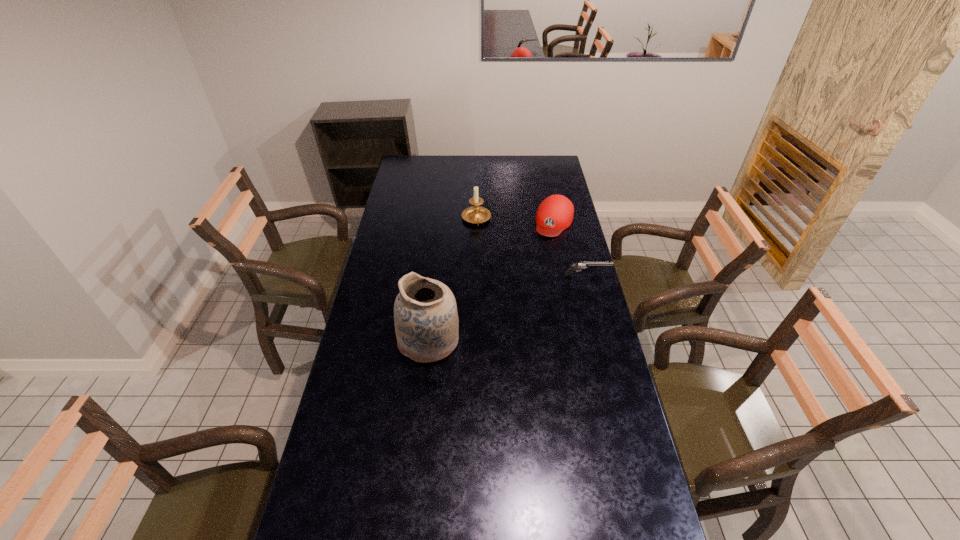
Find the location of a particular element. The image size is (960, 540). object that is the second closest to the baseball cap is located at coordinates (581, 265).

Image resolution: width=960 pixels, height=540 pixels. Find the location of `the closest object to the shortest object`. the closest object to the shortest object is located at coordinates (555, 213).

Locate an element on the screen. The height and width of the screenshot is (540, 960). vacant space that satisfies the following two spatial constraints: 1. on the back side of the third tallest object; 2. on the right side of the nearest object is located at coordinates click(x=442, y=221).

Find the location of a particular element. vacant area that satisfies the following two spatial constraints: 1. on the back side of the nearest object; 2. on the left side of the third shortest object is located at coordinates (442, 219).

Identify the location of vacant region that satisfies the following two spatial constraints: 1. on the back side of the nearest object; 2. on the front-facing side of the shortest object. [436, 275].